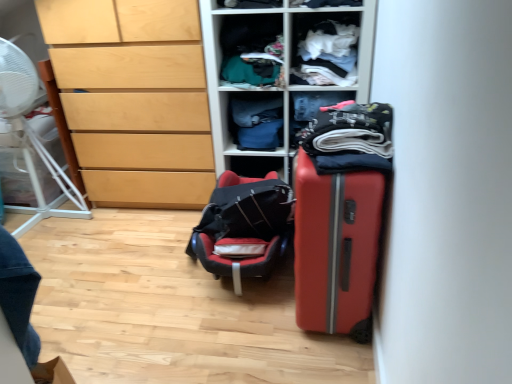
The image size is (512, 384). I want to click on empty space that is ontop of dark blue fabric at center, which ranks as the 2th clothing in back-to-front order, so click(322, 89).